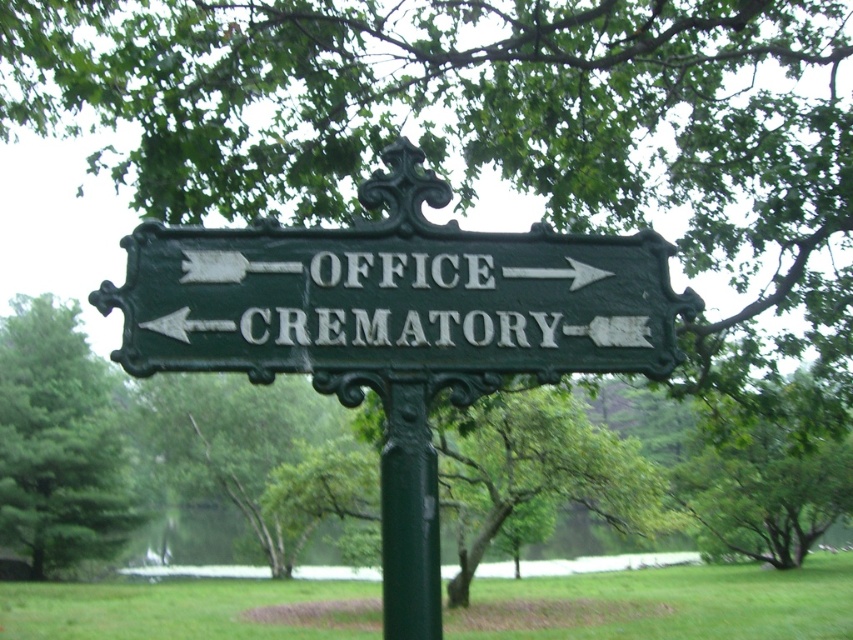
Question: Can you confirm if green cast iron sign at center is bigger than green matte pole at center?

Choices:
 (A) yes
 (B) no

Answer: (A)

Question: Among these points, which one is nearest to the camera?

Choices:
 (A) (476, 252)
 (B) (387, 458)

Answer: (B)

Question: Is green cast iron sign at center wider than green leafy tree at left?

Choices:
 (A) yes
 (B) no

Answer: (A)

Question: Which object appears farthest from the camera in this image?

Choices:
 (A) green matte pole at center
 (B) green cast iron sign at center
 (C) green leafy tree at left

Answer: (C)

Question: Which of these objects is positioned farthest from the green matte pole at center?

Choices:
 (A) green leafy tree at left
 (B) green cast iron sign at center

Answer: (A)

Question: Does green cast iron sign at center appear over green leafy tree at left?

Choices:
 (A) no
 (B) yes

Answer: (B)